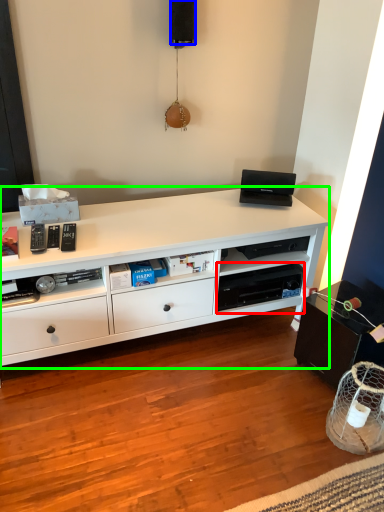
Question: Which object is positioned closest to shelf (highlighted by a red box)? Select from speaker (highlighted by a blue box) and desk (highlighted by a green box).

Choices:
 (A) speaker
 (B) desk

Answer: (B)